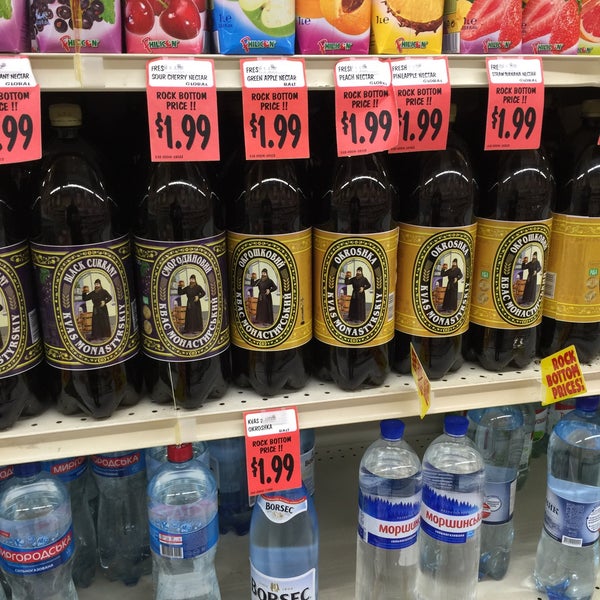
Find the location of a particular element. The image size is (600, 600). bottle is located at coordinates (455, 568).